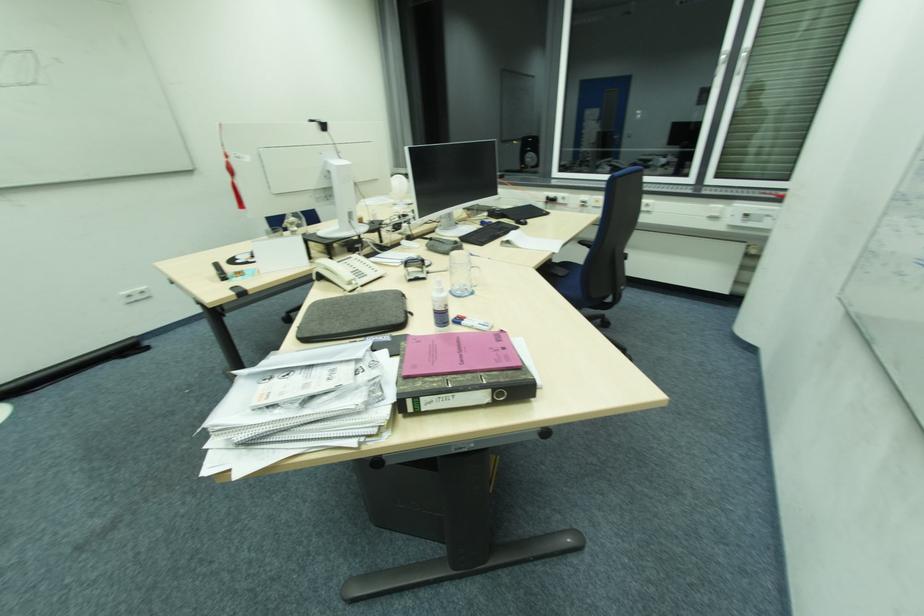
Where would you lift the glass mug handle? Please return your answer as a coordinate pair (x, y).

(460, 289)